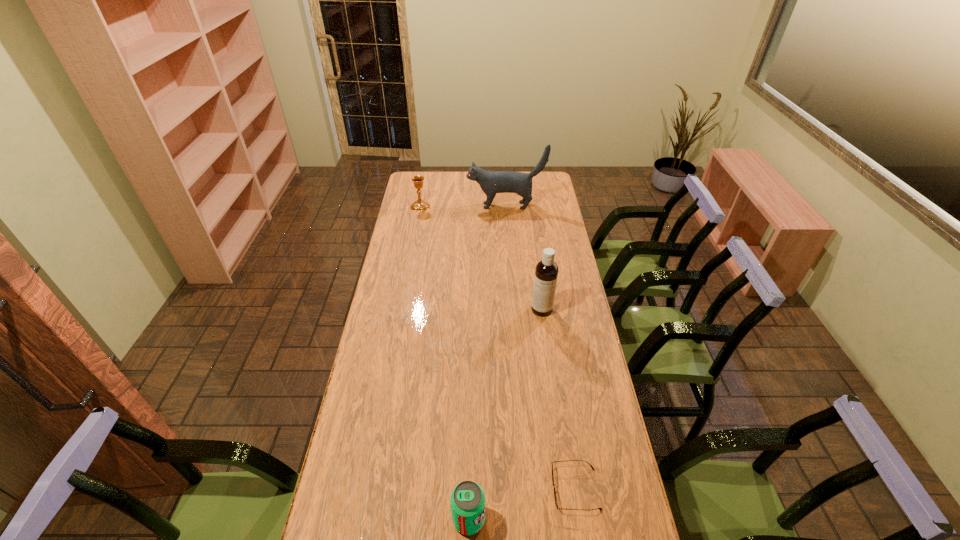
The width and height of the screenshot is (960, 540). Find the location of `vacant region located 0.200m on the right of the chalice`. vacant region located 0.200m on the right of the chalice is located at coordinates (468, 206).

The height and width of the screenshot is (540, 960). I want to click on vacant space located 0.180m on the front-facing side of the pop soda, so click(552, 519).

I want to click on vacant space located 0.380m on the front-facing side of the spectacles, so click(416, 489).

Identify the location of vacant space located on the front-facing side of the spectacles. The height and width of the screenshot is (540, 960). (434, 489).

Find the location of a particular element. vacant area situated 0.070m on the front-facing side of the spectacles is located at coordinates (527, 489).

What are the coordinates of `object at the left edge` in the screenshot? It's located at (420, 205).

This screenshot has width=960, height=540. I want to click on cat situated at the right edge, so click(491, 182).

Locate an element on the screen. Image resolution: width=960 pixels, height=540 pixels. dishwasher detergent present at the right edge is located at coordinates (546, 272).

Where is `spectacles at the right edge`? This screenshot has width=960, height=540. spectacles at the right edge is located at coordinates (556, 504).

In the image, there is a desktop. Identify the location of vacant space at the far edge. (462, 183).